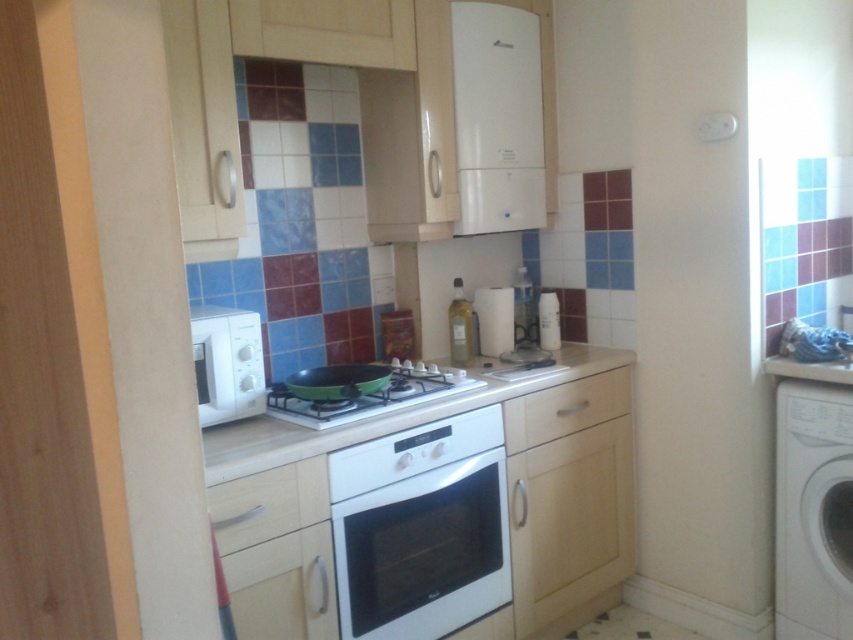
Between point (436, 413) and point (323, 410), which one is positioned behind?

Positioned behind is point (436, 413).

Does white glossy countertop at center appear over white glossy gas stove at center?

Incorrect, white glossy countertop at center is not positioned above white glossy gas stove at center.

This screenshot has height=640, width=853. I want to click on white glossy countertop at center, so click(x=381, y=417).

Find the location of a particular element. The height and width of the screenshot is (640, 853). white glossy countertop at center is located at coordinates (381, 417).

How far apart are white plastic washing machine at right and white glossy gas stove at center?

A distance of 1.08 meters exists between white plastic washing machine at right and white glossy gas stove at center.

Does white plastic washing machine at right have a lesser width compared to white glossy gas stove at center?

Yes, white plastic washing machine at right is thinner than white glossy gas stove at center.

Is point (827, 625) less distant than point (413, 392)?

That is False.

At what (x,y) coordinates should I click in order to perform the action: click on white plastic washing machine at right. Please return your answer as a coordinate pair (x, y). Image resolution: width=853 pixels, height=640 pixels. Looking at the image, I should click on (813, 512).

Can you confirm if white plastic washing machine at right is positioned above white matte microwave at left?

Actually, white plastic washing machine at right is below white matte microwave at left.

Which is behind, point (827, 637) or point (219, 358)?

Point (827, 637)

Is point (805, 600) positioned behind point (229, 355)?

Yes, point (805, 600) is farther from viewer.

Where is `white plastic washing machine at right`? Image resolution: width=853 pixels, height=640 pixels. white plastic washing machine at right is located at coordinates (813, 512).